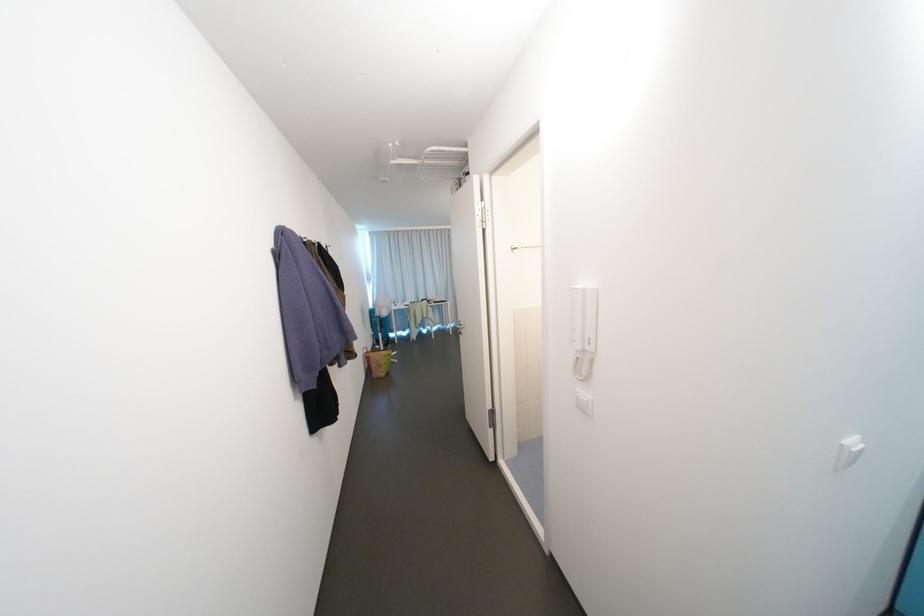
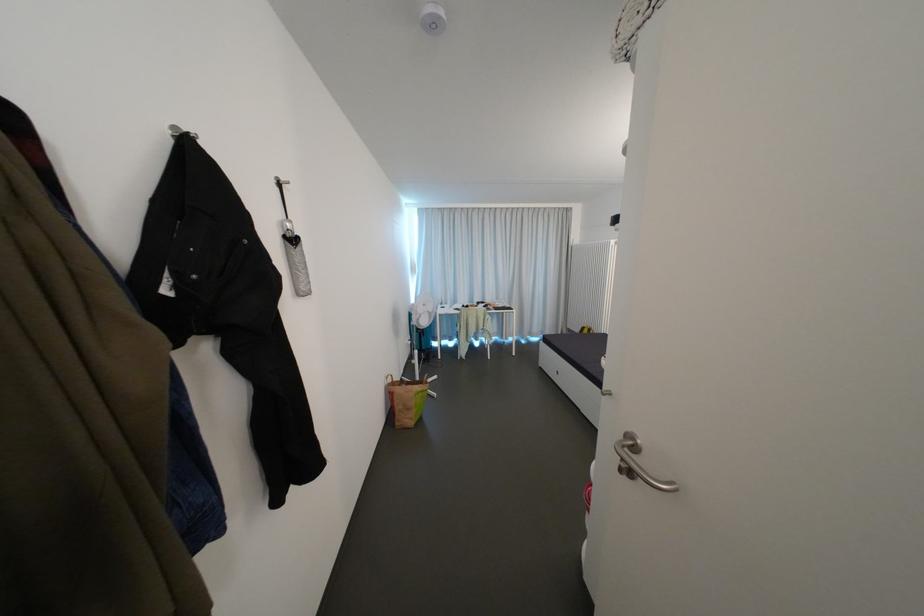
Question: The images are taken continuously from a first-person perspective. In which direction are you moving?

Choices:
 (A) Left
 (B) Right
 (C) Forward
 (D) Backward

Answer: (C)